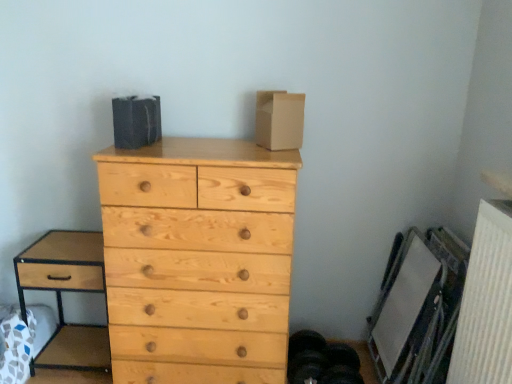
Question: Does natural wood chest of drawers at center have a lesser width compared to brown wood nightstand at left?

Choices:
 (A) yes
 (B) no

Answer: (B)

Question: From the image's perspective, is natural wood chest of drawers at center located beneath brown wood nightstand at left?

Choices:
 (A) no
 (B) yes

Answer: (A)

Question: Does natural wood chest of drawers at center have a lesser height compared to brown wood nightstand at left?

Choices:
 (A) yes
 (B) no

Answer: (B)

Question: Considering the relative sizes of natural wood chest of drawers at center and brown wood nightstand at left in the image provided, is natural wood chest of drawers at center taller than brown wood nightstand at left?

Choices:
 (A) yes
 (B) no

Answer: (A)

Question: Is natural wood chest of drawers at center to the left of brown wood nightstand at left from the viewer's perspective?

Choices:
 (A) no
 (B) yes

Answer: (A)

Question: Considering the relative positions of brown wood nightstand at left and brown cardboard box at upper center in the image provided, is brown wood nightstand at left to the left or to the right of brown cardboard box at upper center?

Choices:
 (A) left
 (B) right

Answer: (A)

Question: Relative to brown cardboard box at upper center, is brown wood nightstand at left in front or behind?

Choices:
 (A) front
 (B) behind

Answer: (B)

Question: In terms of width, does brown wood nightstand at left look wider or thinner when compared to brown cardboard box at upper center?

Choices:
 (A) thin
 (B) wide

Answer: (B)

Question: Considering the positions of brown wood nightstand at left and brown cardboard box at upper center in the image, is brown wood nightstand at left bigger or smaller than brown cardboard box at upper center?

Choices:
 (A) big
 (B) small

Answer: (A)

Question: Visually, is natural wood chest of drawers at center positioned to the left or to the right of brown wood nightstand at left?

Choices:
 (A) right
 (B) left

Answer: (A)

Question: Does point (271, 266) appear closer or farther from the camera than point (46, 281)?

Choices:
 (A) farther
 (B) closer

Answer: (B)

Question: From their relative heights in the image, would you say natural wood chest of drawers at center is taller or shorter than brown wood nightstand at left?

Choices:
 (A) tall
 (B) short

Answer: (A)

Question: Is natural wood chest of drawers at center in front of or behind brown wood nightstand at left in the image?

Choices:
 (A) front
 (B) behind

Answer: (A)

Question: Is white textured radiator at lower right in front of or behind brown wood nightstand at left in the image?

Choices:
 (A) front
 (B) behind

Answer: (A)

Question: Is white textured radiator at lower right wider or thinner than brown wood nightstand at left?

Choices:
 (A) thin
 (B) wide

Answer: (A)